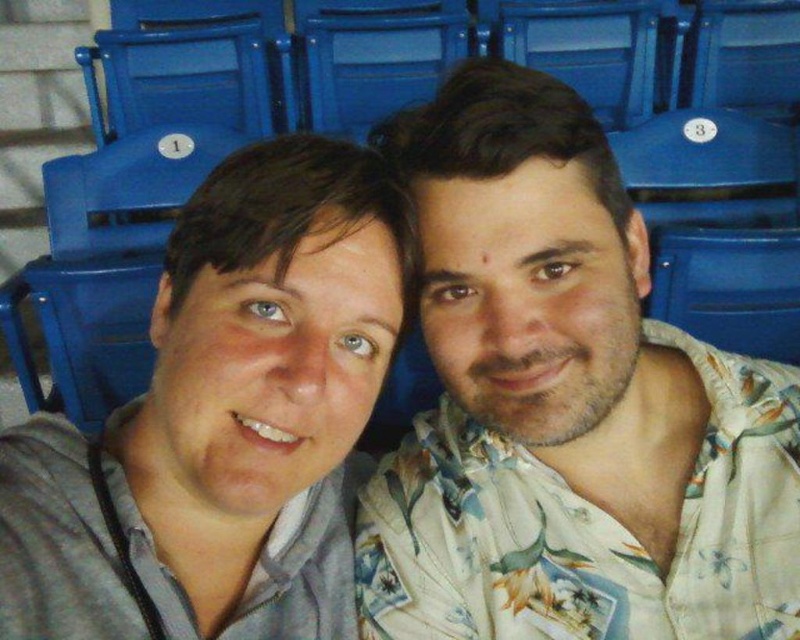
Between blue plastic chair at center and blue plastic chair at upper center, which one is positioned lower?

blue plastic chair at center is below.

Is blue plastic chair at center to the right of blue plastic chair at upper center from the viewer's perspective?

Incorrect, blue plastic chair at center is not on the right side of blue plastic chair at upper center.

Is point (450, 36) positioned after point (600, 20)?

No, it is not.

Identify the location of blue plastic chair at center. (374, 56).

Does floral shirt at center have a greater width compared to blue plastic chair at center?

No, floral shirt at center is not wider than blue plastic chair at center.

Does point (245, 211) come closer to viewer compared to point (412, 33)?

Yes, point (245, 211) is in front of point (412, 33).

The width and height of the screenshot is (800, 640). In order to click on floral shirt at center in this screenshot , I will do `click(224, 420)`.

Who is higher up, floral shirt at center or blue plastic chair at upper center?

Positioned higher is blue plastic chair at upper center.

Who is more distant from viewer, (28,451) or (536,33)?

Point (536,33)

This screenshot has width=800, height=640. Find the location of `floral shirt at center`. floral shirt at center is located at coordinates (224, 420).